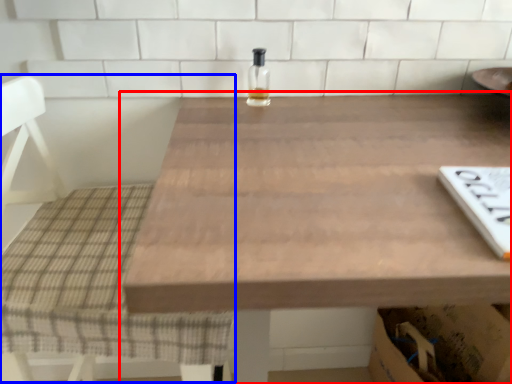
Question: Among these objects, which one is farthest to the camera, table (highlighted by a red box) or chair (highlighted by a blue box)?

Choices:
 (A) table
 (B) chair

Answer: (B)